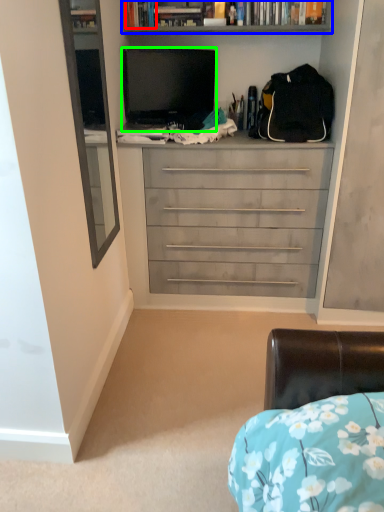
Question: Which is nearer to the book (highlighted by a red box)? bookcase (highlighted by a blue box) or television (highlighted by a green box).

Choices:
 (A) bookcase
 (B) television

Answer: (A)